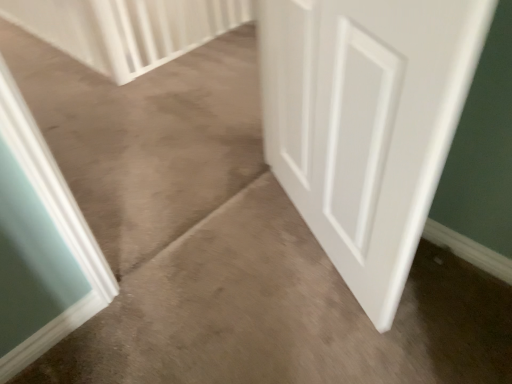
Locate an element on the screen. This screenshot has width=512, height=384. white matte door at center is located at coordinates point(366,123).

What is the approximate height of white matte door at center?

white matte door at center is 88.69 centimeters in height.

Image resolution: width=512 pixels, height=384 pixels. What do you see at coordinates (366, 123) in the screenshot?
I see `white matte door at center` at bounding box center [366, 123].

What is the approximate width of white matte door at center?

It is 3.61 inches.

Find the location of a particular element. white matte door at center is located at coordinates (366, 123).